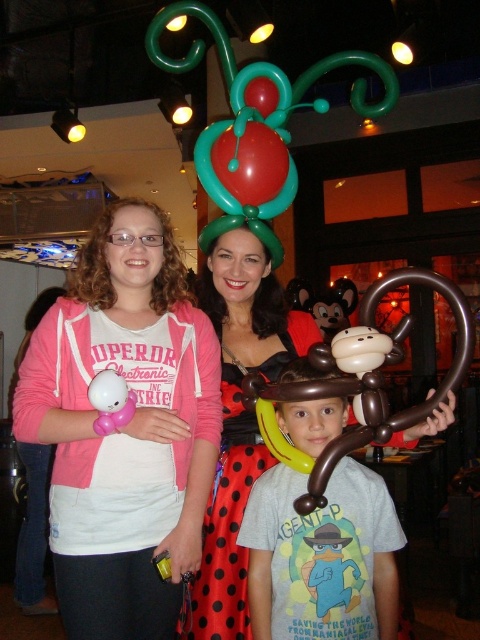
You are standing in the scene and want to move from point A to point B. Point A is at coordinates point (184,452) and point B is at coordinates point (396,516). Which point is closer to you?

Point A at coordinates point (184,452) is closer to you because it is further to the viewer than point B at coordinates point (396,516).

You are a photographer standing at the center of the room. You want to move closer to the point labeled as point (50, 346) to adjust the lighting. If you can move 1.5 meters forward, will you be able to reach that point?

The distance of point (50, 346) from the viewer is 1.53 meters. Moving 1.5 meters forward would bring you to 0.03 meters short of the point, so you won not reach it.

You are a photographer setting up for a group photo. You notice two balloons in the scene, the brown rubber balloon monkey at center and the shiny red balloon at center. Which balloon is bigger?

The brown rubber balloon monkey at center is larger in size than the shiny red balloon at center.